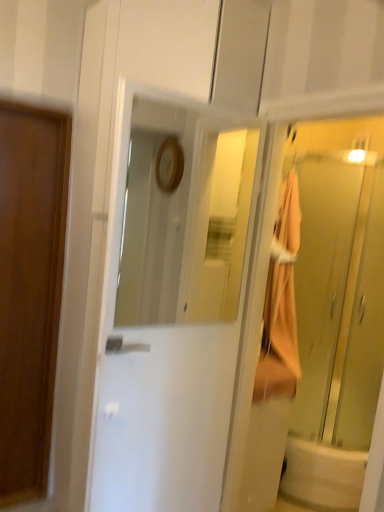
This screenshot has height=512, width=384. Describe the element at coordinates (166, 318) in the screenshot. I see `white glossy door at center, placed as the 2th door when sorted from left to right` at that location.

This screenshot has height=512, width=384. Identify the location of white glossy door at center, the 1th door from the right. (166, 318).

Considering the relative sizes of white glossy door at center, placed as the 2th door when sorted from left to right, and wooden door at left, which is the second door from front to back, in the image provided, is white glossy door at center, placed as the 2th door when sorted from left to right, thinner than wooden door at left, which is the second door from front to back,?

Incorrect, the width of white glossy door at center, placed as the 2th door when sorted from left to right, is not less than that of wooden door at left, which is the second door from front to back.

Considering the relative positions of white glossy door at center, the 1th door from the right, and wooden door at left, which is the second door from front to back, in the image provided, is white glossy door at center, the 1th door from the right, to the left or to the right of wooden door at left, which is the second door from front to back,?

From the image, it's evident that white glossy door at center, the 1th door from the right, is to the right of wooden door at left, which is the second door from front to back.

From a real-world perspective, is white glossy door at center, placed as the 2th door when sorted from left to right, beneath wooden door at left, which ranks as the 1th door in left-to-right order?

No.

Is wooden door at left, which is the second door from front to back, inside white glossy door at center, the 1th door from the right?

No.

Who is shorter, white glossy door at center, acting as the second door starting from the back, or translucent glass elevator at right?

translucent glass elevator at right.

Is white glossy door at center, acting as the second door starting from the back, positioned with its back to translucent glass elevator at right?

No, translucent glass elevator at right is not at the back of white glossy door at center, acting as the second door starting from the back.

How distant is white glossy door at center, the 1th door from the right, from translucent glass elevator at right?

The distance of white glossy door at center, the 1th door from the right, from translucent glass elevator at right is 74.41 centimeters.

Considering their positions, is white glossy door at center, acting as the second door starting from the back, located in front of or behind translucent glass elevator at right?

In the image, white glossy door at center, acting as the second door starting from the back, appears in front of translucent glass elevator at right.

From a real-world perspective, which is physically below, translucent glass elevator at right or white glossy door at center, acting as the second door starting from the back?

white glossy door at center, acting as the second door starting from the back, from a real-world perspective.

Is translucent glass elevator at right turned away from white glossy door at center, the 1th door from the right?

No.

In the image, is translucent glass elevator at right positioned in front of or behind white glossy door at center, placed as the 2th door when sorted from left to right?

translucent glass elevator at right is positioned farther from the viewer than white glossy door at center, placed as the 2th door when sorted from left to right.

From the image's perspective, which is below, translucent glass elevator at right or white glossy door at center, the 1th door from the right?

white glossy door at center, the 1th door from the right, from the image's perspective.

What's the angular difference between translucent glass elevator at right and wooden door at left, which is the second door in right-to-left order,'s facing directions?

They differ by 41.4 degrees in their facing directions.

Could you tell me if translucent glass elevator at right is facing wooden door at left, which is the second door from front to back?

No, translucent glass elevator at right is not oriented towards wooden door at left, which is the second door from front to back.

Between translucent glass elevator at right and wooden door at left, which ranks as the 1th door in left-to-right order, which one has larger width?

With larger width is translucent glass elevator at right.

From a real-world perspective, is translucent glass elevator at right below wooden door at left, which is the second door from front to back?

No, from a real-world perspective, translucent glass elevator at right is not below wooden door at left, which is the second door from front to back.

Would you say white glossy door at center, placed as the 2th door when sorted from left to right, is to the left or to the right of white glossy bathtub at lower right in the picture?

Clearly, white glossy door at center, placed as the 2th door when sorted from left to right, is on the left of white glossy bathtub at lower right in the image.

Is white glossy door at center, the 1th door from the right, not near white glossy bathtub at lower right?

Indeed, white glossy door at center, the 1th door from the right, is not near white glossy bathtub at lower right.

Does point (199, 403) appear closer or farther from the camera than point (343, 458)?

Point (199, 403) is positioned closer to the camera compared to point (343, 458).

Consider the image. From a real-world perspective, is white glossy door at center, the 1th door from the right, positioned under white glossy bathtub at lower right based on gravity?

No, from a real-world perspective, white glossy door at center, the 1th door from the right, is not below white glossy bathtub at lower right.

In terms of width, does wooden door at left, which ranks as the 1th door in left-to-right order, look wider or thinner when compared to translucent glass elevator at right?

In the image, wooden door at left, which ranks as the 1th door in left-to-right order, appears to be more narrow than translucent glass elevator at right.

How distant is wooden door at left, which appears as the 1th door when viewed from the back, from translucent glass elevator at right?

wooden door at left, which appears as the 1th door when viewed from the back, is 1.35 meters from translucent glass elevator at right.

Do you think wooden door at left, which appears as the 1th door when viewed from the back, is within translucent glass elevator at right, or outside of it?

wooden door at left, which appears as the 1th door when viewed from the back, exists outside the volume of translucent glass elevator at right.

You are a GUI agent. You are given a task and a screenshot of the screen. Output one action in this format:
    pyautogui.click(x=<x>, y=<y>)
    Task: Click on the door that is the 1st object located below the translucent glass elevator at right (from the image's perspective)
    The width and height of the screenshot is (384, 512).
    Given the screenshot: What is the action you would take?
    pyautogui.click(x=30, y=289)

In the scene shown: Which point is more distant from viewer, (255,268) or (326,500)?

The point (326,500) is behind.

From a real-world perspective, does translucent glass elevator at right stand above white glossy bathtub at lower right?

Yes, from a real-world perspective, translucent glass elevator at right is on top of white glossy bathtub at lower right.

Who is taller, translucent glass elevator at right or white glossy bathtub at lower right?

Standing taller between the two is translucent glass elevator at right.

Which is more to the left, translucent glass elevator at right or white glossy bathtub at lower right?

translucent glass elevator at right.

You are a GUI agent. You are given a task and a screenshot of the screen. Output one action in this format:
    pyautogui.click(x=<x>, y=<y>)
    Task: Click on the door above the white glossy door at center, placed as the 2th door when sorted from left to right (from the image's perspective)
    
    Given the screenshot: What is the action you would take?
    pyautogui.click(x=30, y=289)

Where is `door that is the 1st one below the translucent glass elevator at right (from a real-world perspective)`? Image resolution: width=384 pixels, height=512 pixels. door that is the 1st one below the translucent glass elevator at right (from a real-world perspective) is located at coordinates (166, 318).

From the image, which object appears to be nearer to translucent glass elevator at right, white glossy bathtub at lower right or wooden door at left, which is the second door in right-to-left order?

The object closer to translucent glass elevator at right is white glossy bathtub at lower right.

From the image, which object appears to be nearer to wooden door at left, which is the second door from front to back, translucent glass elevator at right or white glossy bathtub at lower right?

translucent glass elevator at right lies closer to wooden door at left, which is the second door from front to back, than the other object.

Considering their positions, is white glossy door at center, the 1th door from the right, positioned closer to white glossy bathtub at lower right than translucent glass elevator at right?

Among the two, translucent glass elevator at right is located nearer to white glossy bathtub at lower right.

Estimate the real-world distances between objects in this image. Which object is further from wooden door at left, which is the second door in right-to-left order, white glossy bathtub at lower right or translucent glass elevator at right?

white glossy bathtub at lower right lies further to wooden door at left, which is the second door in right-to-left order, than the other object.

Considering their positions, is wooden door at left, which is the second door in right-to-left order, positioned further to white glossy door at center, the 1th door when ordered from front to back, than white glossy bathtub at lower right?

Among the two, white glossy bathtub at lower right is located further to white glossy door at center, the 1th door when ordered from front to back.

Which object lies further to the anchor point wooden door at left, which is the second door in right-to-left order, white glossy door at center, the 1th door when ordered from front to back, or translucent glass elevator at right?

Based on the image, translucent glass elevator at right appears to be further to wooden door at left, which is the second door in right-to-left order.

In the scene shown: Estimate the real-world distances between objects in this image. Which object is closer to wooden door at left, which ranks as the 1th door in left-to-right order, translucent glass elevator at right or white glossy door at center, placed as the 2th door when sorted from left to right?

Among the two, white glossy door at center, placed as the 2th door when sorted from left to right, is located nearer to wooden door at left, which ranks as the 1th door in left-to-right order.

Which object lies further to the anchor point white glossy door at center, placed as the 2th door when sorted from left to right, white glossy bathtub at lower right or translucent glass elevator at right?

white glossy bathtub at lower right is positioned further to the anchor white glossy door at center, placed as the 2th door when sorted from left to right.

Identify the location of elevator between wooden door at left, which ranks as the 1th door in left-to-right order, and white glossy bathtub at lower right from left to right. The image size is (384, 512). (317, 301).

This screenshot has height=512, width=384. I want to click on door situated between wooden door at left, which is the second door in right-to-left order, and translucent glass elevator at right from left to right, so click(166, 318).

Where is `door situated between wooden door at left, which ranks as the 1th door in left-to-right order, and white glossy bathtub at lower right from left to right`? This screenshot has width=384, height=512. door situated between wooden door at left, which ranks as the 1th door in left-to-right order, and white glossy bathtub at lower right from left to right is located at coordinates (166, 318).